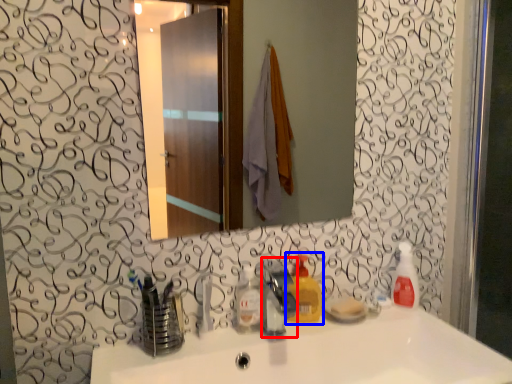
Question: Which object is further to the camera taking this photo, faucet (highlighted by a red box) or cleaning product (highlighted by a blue box)?

Choices:
 (A) faucet
 (B) cleaning product

Answer: (B)